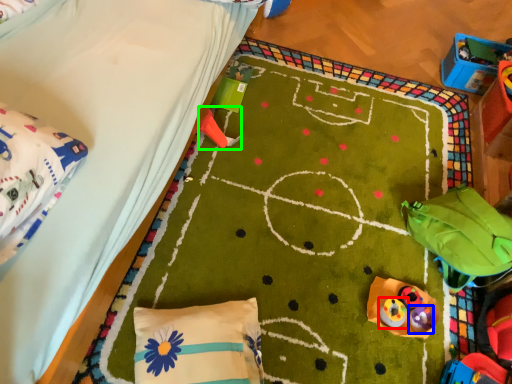
Question: Which object is the closest to the toy (highlighted by a red box)? Choose among these: toy (highlighted by a blue box) or toy (highlighted by a green box).

Choices:
 (A) toy
 (B) toy

Answer: (A)